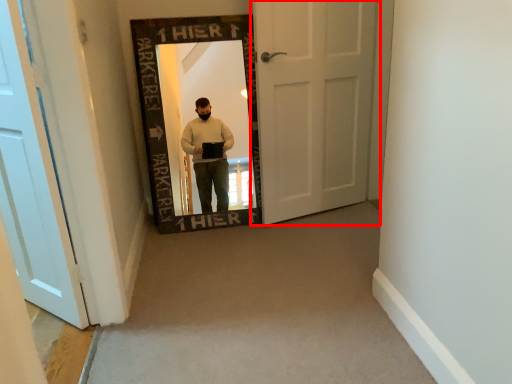
Question: From the image's perspective, where is door (annotated by the red box) located relative to door?

Choices:
 (A) above
 (B) below

Answer: (A)